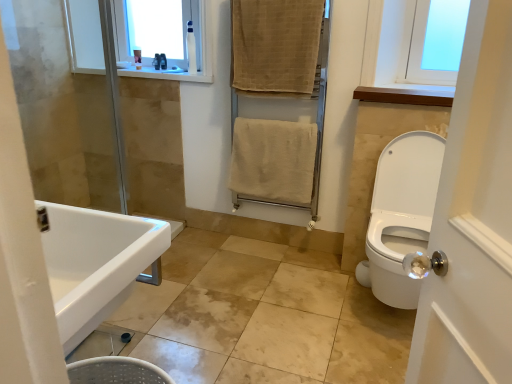
Question: Does beige textured towel at upper center, the second bath towel in the bottom-to-top sequence, have a greater height compared to white glossy sink at lower left?

Choices:
 (A) no
 (B) yes

Answer: (B)

Question: From the image's perspective, is beige textured towel at upper center, which appears as the first bath towel when viewed from the top, on white glossy sink at lower left?

Choices:
 (A) no
 (B) yes

Answer: (B)

Question: Can you confirm if beige textured towel at upper center, the second bath towel in the bottom-to-top sequence, is positioned to the right of white glossy sink at lower left?

Choices:
 (A) yes
 (B) no

Answer: (A)

Question: Considering the relative sizes of beige textured towel at upper center, which appears as the first bath towel when viewed from the top, and white glossy sink at lower left in the image provided, is beige textured towel at upper center, which appears as the first bath towel when viewed from the top, bigger than white glossy sink at lower left?

Choices:
 (A) no
 (B) yes

Answer: (A)

Question: Can you confirm if beige textured towel at upper center, the second bath towel in the bottom-to-top sequence, is wider than white glossy sink at lower left?

Choices:
 (A) yes
 (B) no

Answer: (B)

Question: Considering the positions of white plastic bottle at upper center, placed as the third toiletry when sorted from back to front, and clear plastic bottle at upper center, the 2th toiletry in the back-to-front sequence, in the image, is white plastic bottle at upper center, placed as the third toiletry when sorted from back to front, taller or shorter than clear plastic bottle at upper center, the 2th toiletry in the back-to-front sequence,?

Choices:
 (A) short
 (B) tall

Answer: (B)

Question: Is white plastic bottle at upper center, arranged as the first toiletry when viewed from the front, inside the boundaries of clear plastic bottle at upper center, the 2th toiletry in the back-to-front sequence, or outside?

Choices:
 (A) inside
 (B) outside

Answer: (B)

Question: From a real-world perspective, is white plastic bottle at upper center, placed as the first toiletry when sorted from right to left, above or below clear plastic bottle at upper center, the 2th toiletry in the back-to-front sequence?

Choices:
 (A) above
 (B) below

Answer: (A)

Question: From the image's perspective, is white plastic bottle at upper center, which appears as the third toiletry when viewed from the left, located above or below clear plastic bottle at upper center, the 2th toiletry in the back-to-front sequence?

Choices:
 (A) above
 (B) below

Answer: (A)

Question: Which is correct: white glossy sink at lower left is inside beige textured towel at upper center, the second bath towel in the bottom-to-top sequence, or outside of it?

Choices:
 (A) inside
 (B) outside

Answer: (B)

Question: Considering the positions of white glossy sink at lower left and beige textured towel at upper center, which appears as the first bath towel when viewed from the top, in the image, is white glossy sink at lower left wider or thinner than beige textured towel at upper center, which appears as the first bath towel when viewed from the top,?

Choices:
 (A) wide
 (B) thin

Answer: (A)

Question: Is point (135, 268) positioned closer to the camera than point (300, 14)?

Choices:
 (A) closer
 (B) farther

Answer: (A)

Question: From a real-world perspective, is white glossy sink at lower left positioned above or below beige textured towel at upper center, which appears as the first bath towel when viewed from the top?

Choices:
 (A) above
 (B) below

Answer: (B)

Question: Looking at the image, does clear plastic bottle at upper center, the 2th toiletry in the back-to-front sequence, seem bigger or smaller compared to beige textured towel rack at center?

Choices:
 (A) small
 (B) big

Answer: (A)

Question: Considering the positions of point tap(159, 66) and point tap(284, 49), is point tap(159, 66) closer or farther from the camera than point tap(284, 49)?

Choices:
 (A) farther
 (B) closer

Answer: (A)